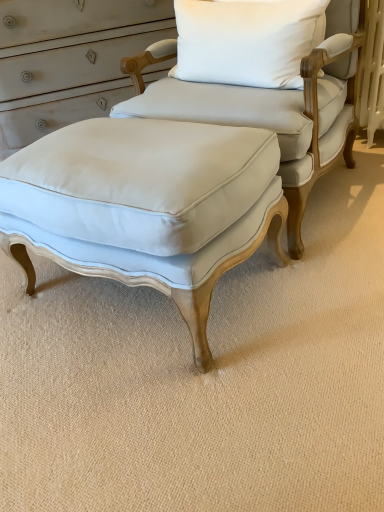
Question: Considering the relative sizes of white cotton pillow at upper center and light blue fabric ottoman at center in the image provided, is white cotton pillow at upper center smaller than light blue fabric ottoman at center?

Choices:
 (A) no
 (B) yes

Answer: (B)

Question: Considering the relative positions of white cotton pillow at upper center and light blue fabric ottoman at center in the image provided, is white cotton pillow at upper center in front of light blue fabric ottoman at center?

Choices:
 (A) yes
 (B) no

Answer: (B)

Question: Is white cotton pillow at upper center facing away from light blue fabric ottoman at center?

Choices:
 (A) yes
 (B) no

Answer: (A)

Question: Is white cotton pillow at upper center to the left of light blue fabric ottoman at center from the viewer's perspective?

Choices:
 (A) no
 (B) yes

Answer: (B)

Question: Considering the relative sizes of white cotton pillow at upper center and light blue fabric ottoman at center in the image provided, is white cotton pillow at upper center bigger than light blue fabric ottoman at center?

Choices:
 (A) no
 (B) yes

Answer: (A)

Question: Is white cotton pillow at upper center completely or partially outside of light blue fabric ottoman at center?

Choices:
 (A) no
 (B) yes

Answer: (A)

Question: Does light blue fabric ottoman at center have a smaller size compared to white cotton pillow at upper center?

Choices:
 (A) yes
 (B) no

Answer: (B)

Question: Does light blue fabric ottoman at center turn towards white cotton pillow at upper center?

Choices:
 (A) yes
 (B) no

Answer: (A)

Question: Is light blue fabric ottoman at center further to the viewer compared to white cotton pillow at upper center?

Choices:
 (A) no
 (B) yes

Answer: (A)

Question: Is light blue fabric ottoman at center looking in the opposite direction of white cotton pillow at upper center?

Choices:
 (A) no
 (B) yes

Answer: (A)

Question: Does light blue fabric ottoman at center have a larger size compared to white cotton pillow at upper center?

Choices:
 (A) yes
 (B) no

Answer: (A)

Question: Does light blue fabric ottoman at center have a greater height compared to white cotton pillow at upper center?

Choices:
 (A) yes
 (B) no

Answer: (A)

Question: Are light blue fabric ottoman at center and matte white fabric stool at center far apart?

Choices:
 (A) yes
 (B) no

Answer: (B)